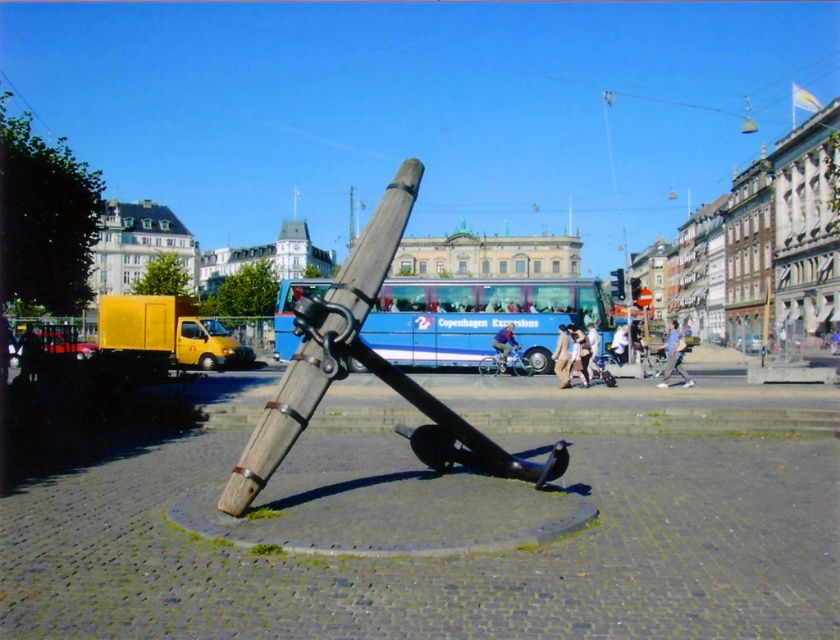
Question: Is wooden anchor at center above blue metallic bus at center?

Choices:
 (A) no
 (B) yes

Answer: (B)

Question: Considering the relative positions of wooden anchor at center and blue metallic bus at center in the image provided, where is wooden anchor at center located with respect to blue metallic bus at center?

Choices:
 (A) left
 (B) right

Answer: (B)

Question: Which point is closer to the camera?

Choices:
 (A) blue metallic bus at center
 (B) wooden anchor at center

Answer: (B)

Question: Does wooden anchor at center have a lesser width compared to blue metallic bus at center?

Choices:
 (A) yes
 (B) no

Answer: (A)